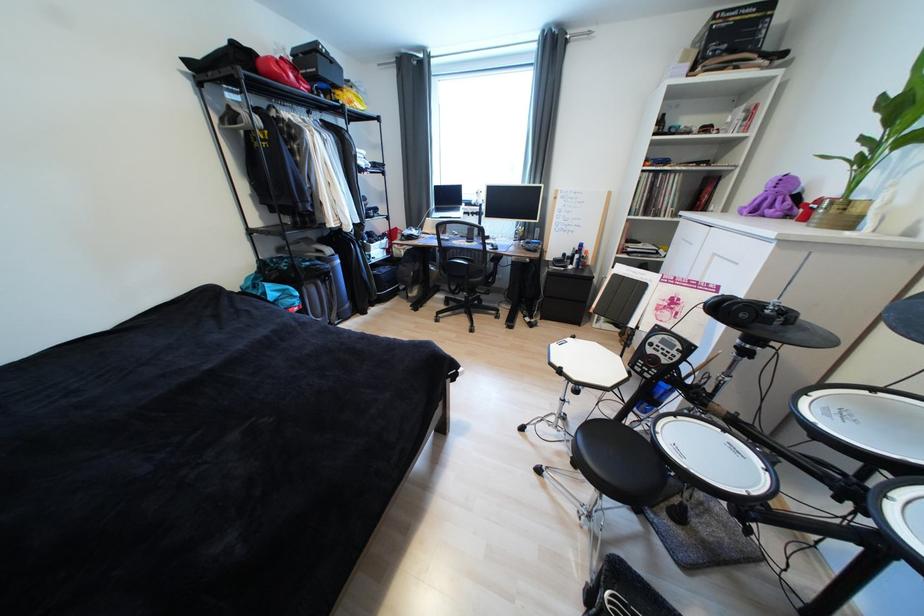
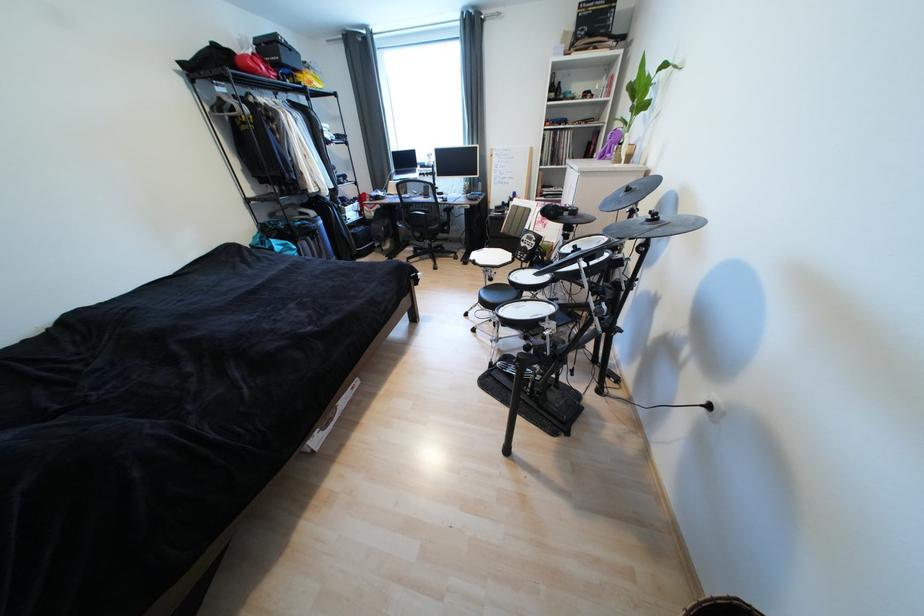
Locate, in the second image, the point that corresponds to (x=761, y=212) in the first image.

(609, 156)